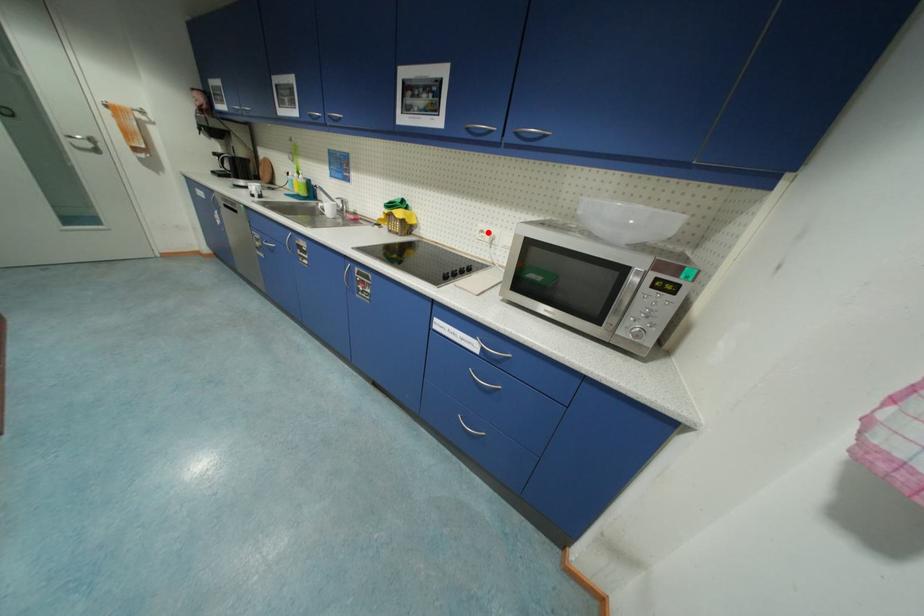
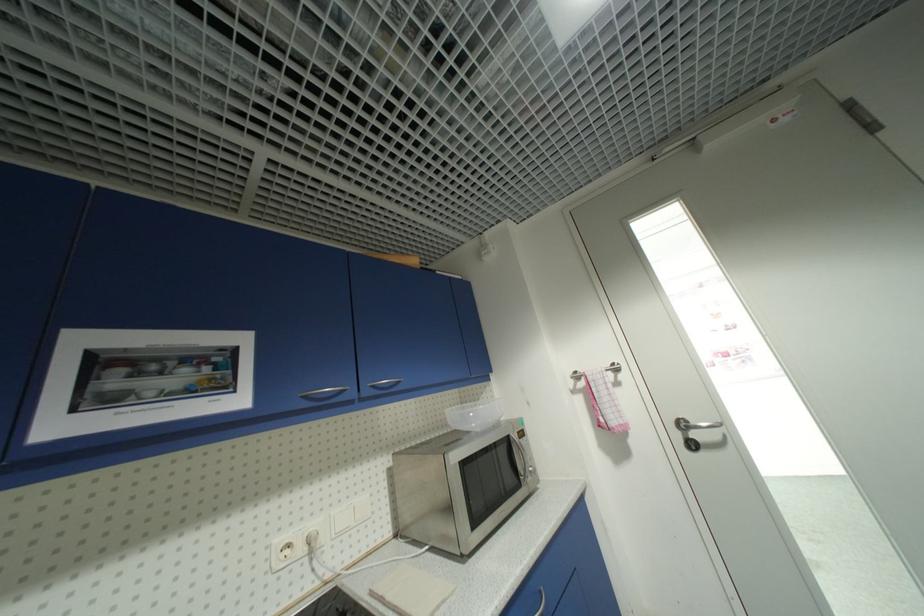
Question: I am providing you with two images of the same scene from different viewpoints. A red point is shown in image1. For the corresponding object point in image2, is it positioned nearer or farther from the camera?

Choices:
 (A) Nearer
 (B) Farther

Answer: (B)